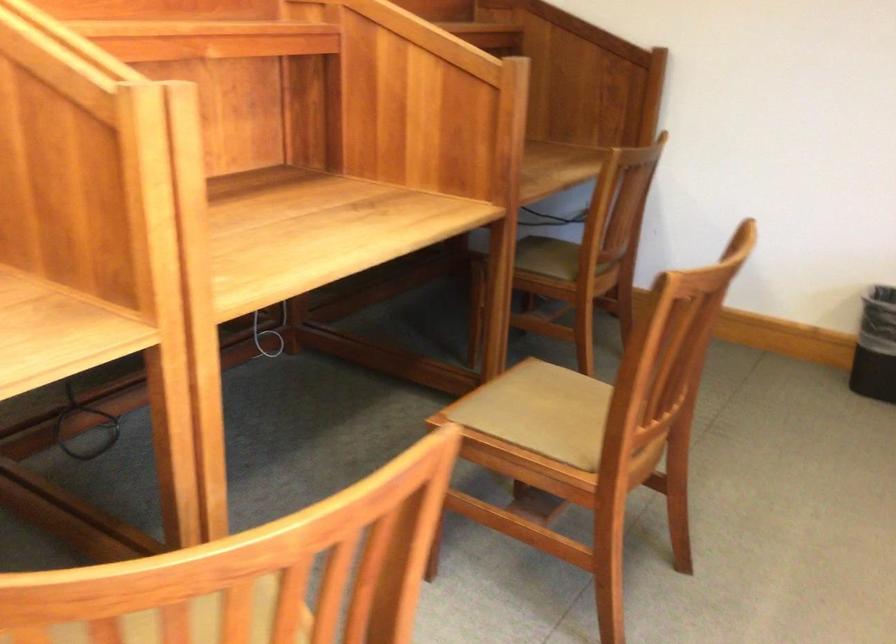
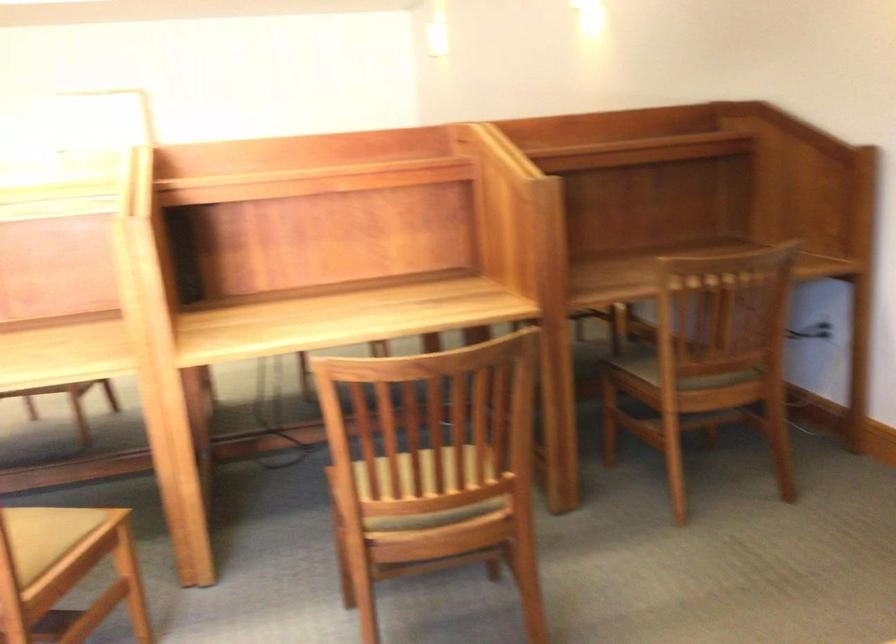
The point at (618, 248) is marked in the first image. Where is the corresponding point in the second image?

(698, 361)